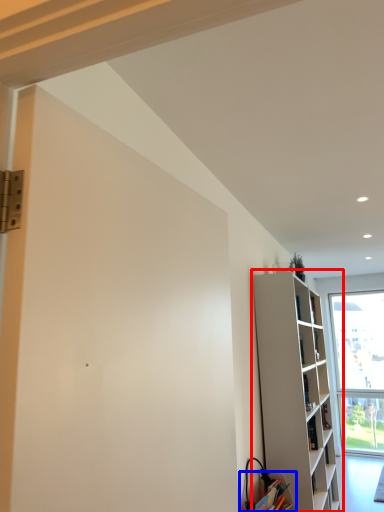
Question: Which point is closer to the camera, shelf (highlighted by a red box) or cabinetry (highlighted by a blue box)?

Choices:
 (A) shelf
 (B) cabinetry

Answer: (B)